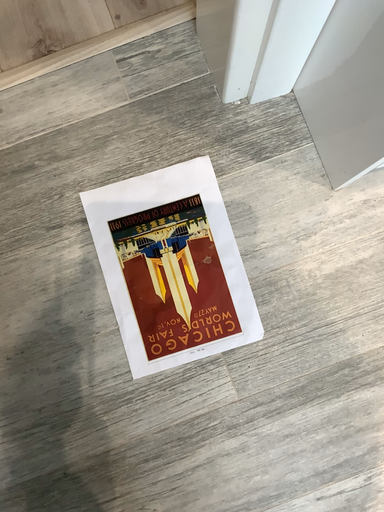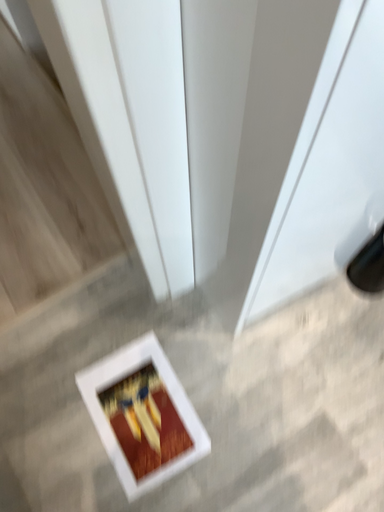
Question: Which way did the camera rotate in the video?

Choices:
 (A) rotated upward
 (B) rotated downward

Answer: (A)